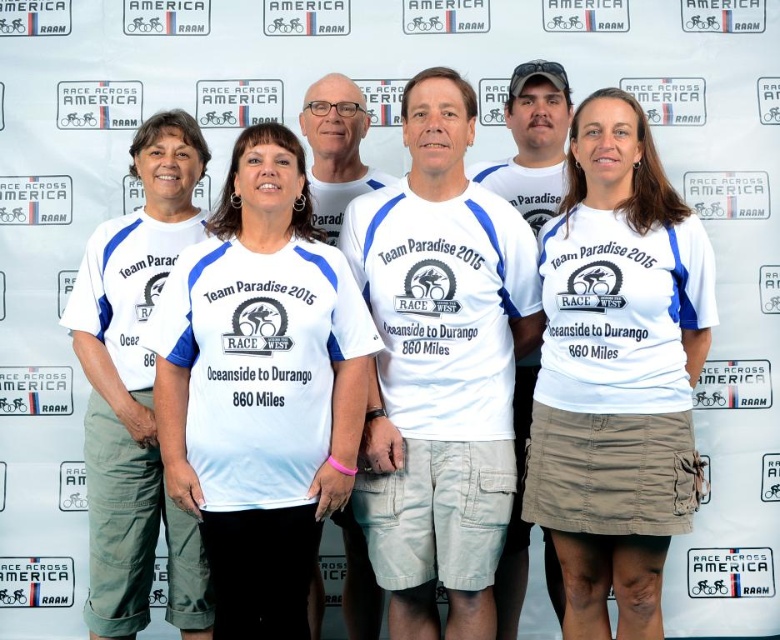
Looking at the group photo of Team Paradise 2015, you notice two white shirts at the center of the image. According to the scene description, both are labeled as either white fabric shirt at center or white cotton shirt at center. Which of these two shirts is positioned to the left?

The white fabric shirt at center is positioned to the left of the white cotton shirt at center.